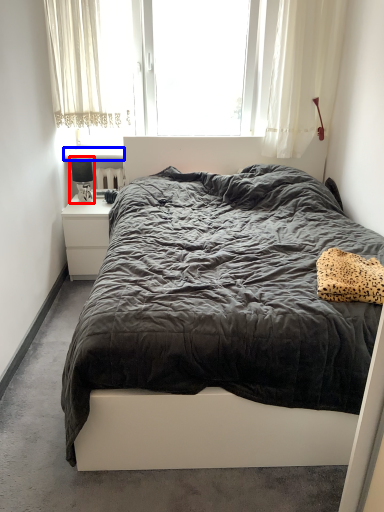
Question: Which point is closer to the camera, lamp (highlighted by a red box) or window sill (highlighted by a blue box)?

Choices:
 (A) lamp
 (B) window sill

Answer: (A)